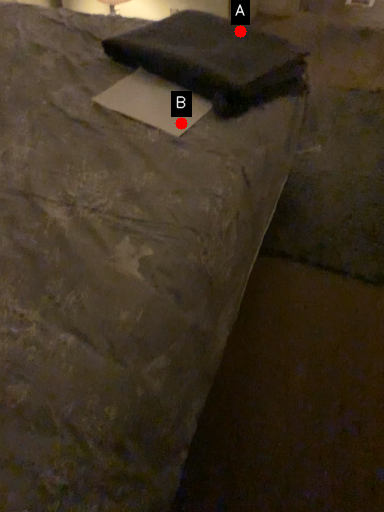
Question: Two points are circled on the image, labeled by A and B beside each circle. Which of the following is the closest to the observer?

Choices:
 (A) A is closer
 (B) B is closer

Answer: (B)